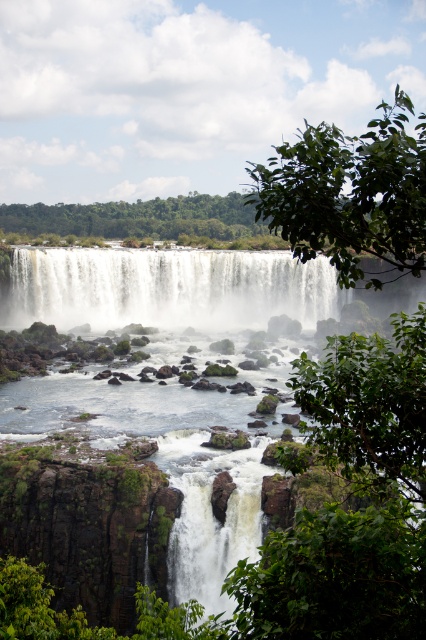
Question: Which point is farther from the camera taking this photo?

Choices:
 (A) (265, 285)
 (B) (386, 528)

Answer: (A)

Question: Which point is farther from the camera taking this photo?

Choices:
 (A) (204, 275)
 (B) (253, 625)

Answer: (A)

Question: Does white misty water at center come behind white misty waterfall at center?

Choices:
 (A) no
 (B) yes

Answer: (A)

Question: Is white misty water at center to the left of white misty waterfall at center from the viewer's perspective?

Choices:
 (A) yes
 (B) no

Answer: (B)

Question: Can you confirm if white misty water at center is bigger than white misty waterfall at center?

Choices:
 (A) yes
 (B) no

Answer: (A)